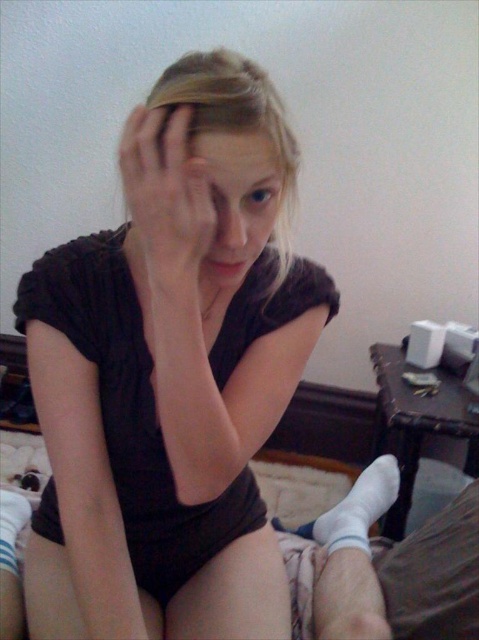
You are a photographer trying to capture a closeup of the blonde hair at center. The camera you are using has a minimum focusing distance of 18 inches. Can you take the photo without moving either the camera or the subject?

The distance between the blonde hair at center and the camera is 20.89 inches, which is greater than the minimum focusing distance of 18 inches. Therefore, you can take the photo without moving either the camera or the subject.

You are a photographer trying to capture a closeup of the person in the image. You want to focus on the blonde hair at center and smooth skin at center. Can you fit both into your camera frame if the maximum distance your camera can focus on two objects is 3 inches?

The blonde hair at center and smooth skin at center are 3.08 inches apart, which exceeds the camera frame limit of 3 inches. Therefore, both cannot be focused on simultaneously.

You are a photographer setting up a portrait shot. You need to ensure that the matte black shirt at center and the blonde hair at center are both in focus. Given that your camera has a depth of field that can cover 8 inches, will both subjects be in focus?

The distance between the matte black shirt at center and the blonde hair at center is 7.63 inches, which is within the camera depth of field of 8 inches. Therefore, both subjects will be in focus.